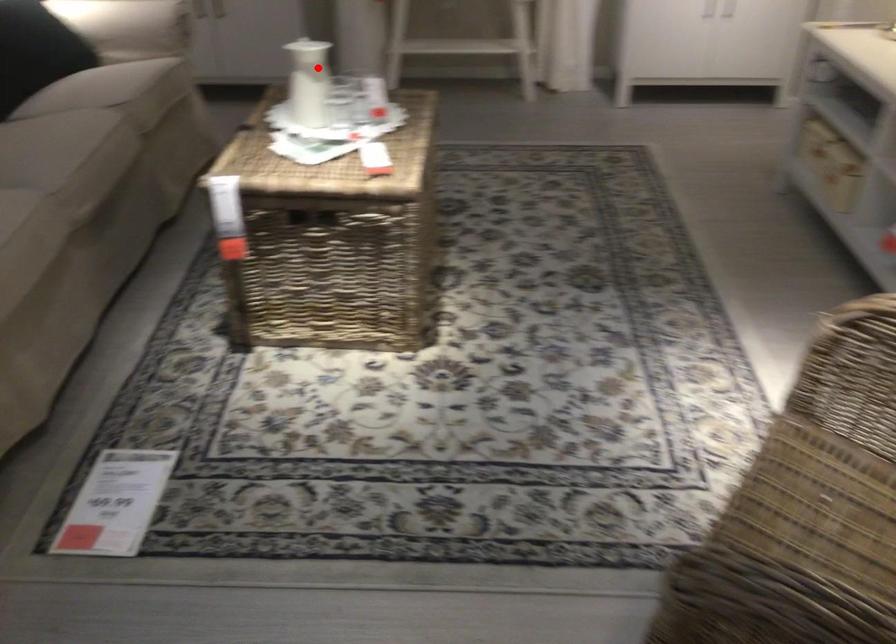
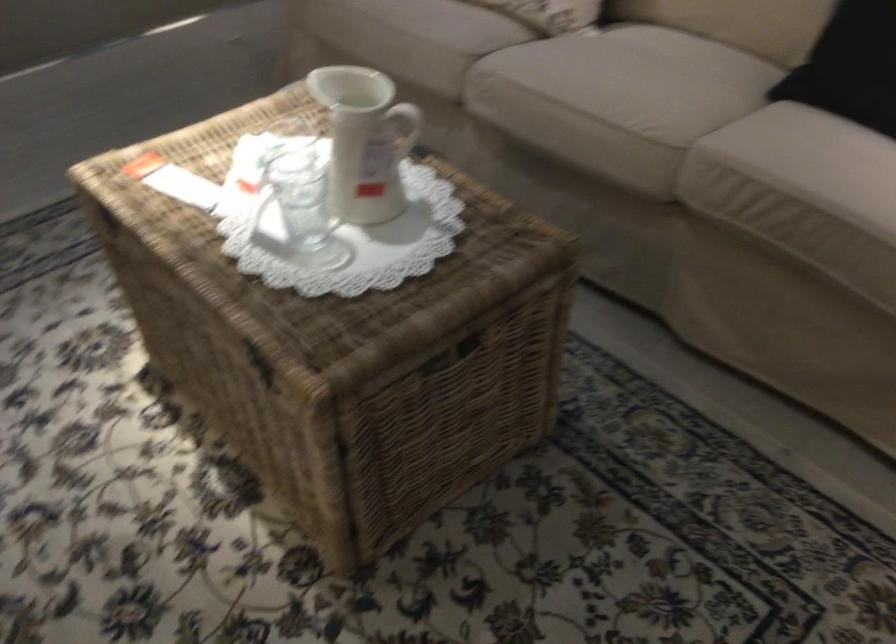
The point at the highlighted location is marked in the first image. Where is the corresponding point in the second image?

(365, 140)